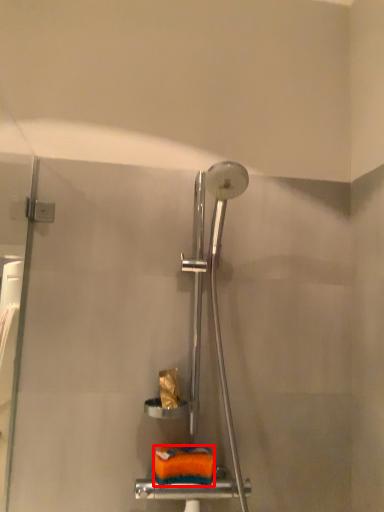
Question: Considering the relative positions of material (annotated by the red box) and toilet paper in the image provided, where is material (annotated by the red box) located with respect to the staircase?

Choices:
 (A) right
 (B) left

Answer: (A)